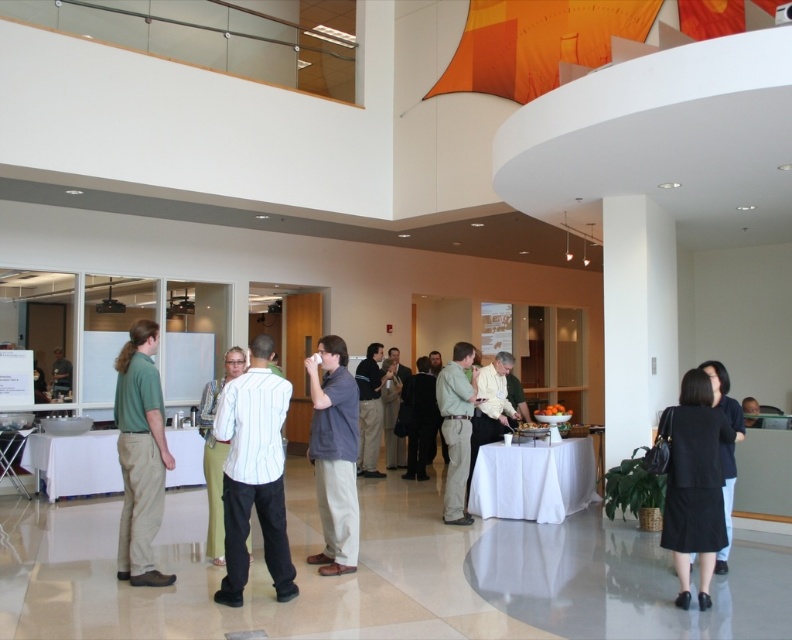
Question: Does gray fabric shirt at center have a greater width compared to light brown shirt at center?

Choices:
 (A) yes
 (B) no

Answer: (B)

Question: Is black fabric skirt at lower right closer to the viewer compared to light green pants at center?

Choices:
 (A) yes
 (B) no

Answer: (A)

Question: Where is matte green shirt at left located in relation to light brown hair at center in the image?

Choices:
 (A) right
 (B) left

Answer: (B)

Question: Among these points, which one is farthest from the camera?

Choices:
 (A) (747, 426)
 (B) (313, 385)
 (C) (212, 563)

Answer: (A)

Question: Which point is closer to the camera?

Choices:
 (A) white cloth table at center
 (B) light green pants at center

Answer: (B)

Question: Which object appears closest to the camera in this image?

Choices:
 (A) light brown hair at center
 (B) white glossy table at lower left

Answer: (A)